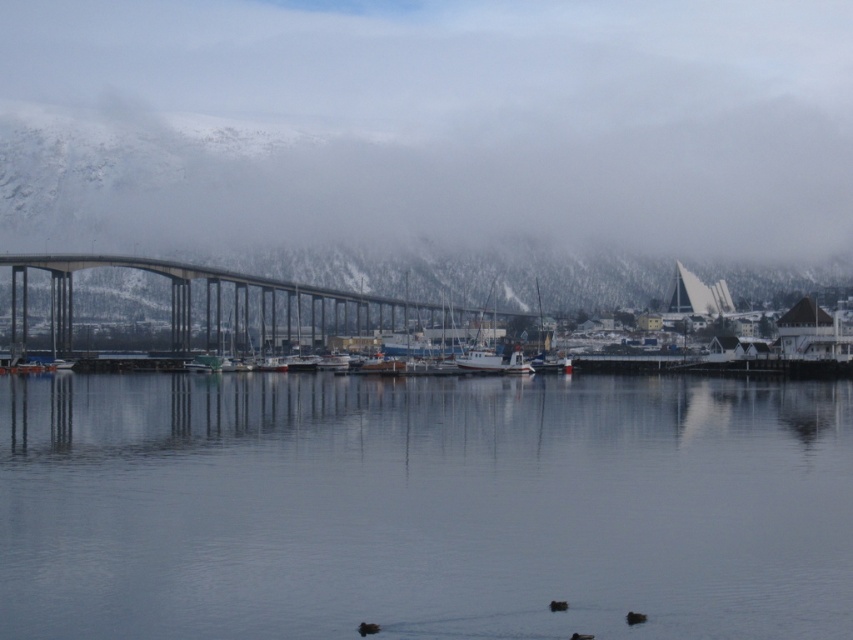
You are a photographer standing at the waterfront. You want to capture a photo that shows both the transparent water at center and the concrete bridge at center. Which object will appear taller in the photo?

The concrete bridge at center will appear taller in the photo because the transparent water at center is not as tall as the concrete bridge at center.

Based on the photo, you are a boat captain planning to navigate a vessel through the transparent water at center. The boat requires a minimum clearance of 500 feet to pass safely under the concrete bridge at center. Based on the scene description, is the available clearance sufficient for your vessel?

The distance between the transparent water at center and the concrete bridge at center is 477.58 feet, which is less than the required 500 feet clearance. Therefore, the vessel cannot safely pass under the concrete bridge at center with the current clearance.

You are standing at the point with coordinates point (602, 611) and want to walk towards the point with coordinates point (186, 328). Based on the scene description, will you pass by the bridge pillars before reaching your destination?

Yes, because point (602, 611) is in front of point (186, 328), so you will pass by the bridge pillars before reaching your destination.